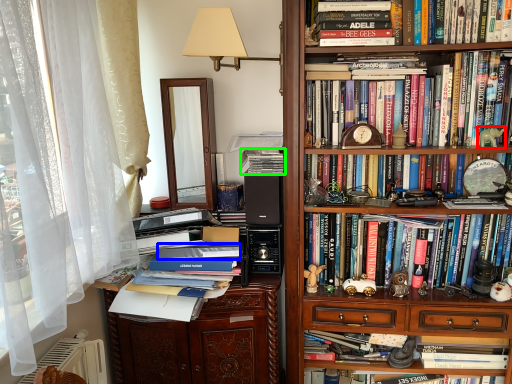
Question: Which object is the closest to the toy (highlighted by a red box)? Choose among these: paperback book (highlighted by a blue box) or book (highlighted by a green box).

Choices:
 (A) paperback book
 (B) book

Answer: (B)